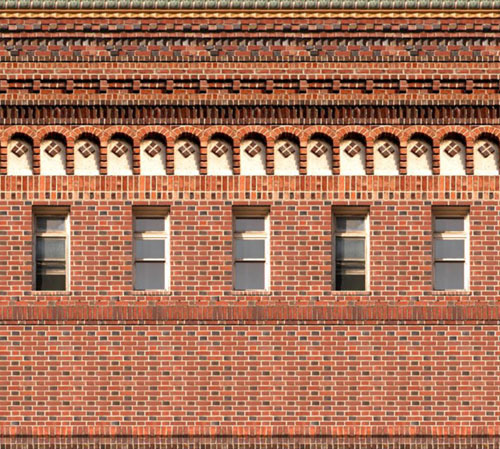
You are a GUI agent. You are given a task and a screenshot of the screen. Output one action in this format:
    pyautogui.click(x=<x>, y=<y>)
    Task: Click on the white trim under gray molding
    This screenshot has width=500, height=449.
    Given the screenshot: What is the action you would take?
    pyautogui.click(x=114, y=11), pyautogui.click(x=395, y=12)